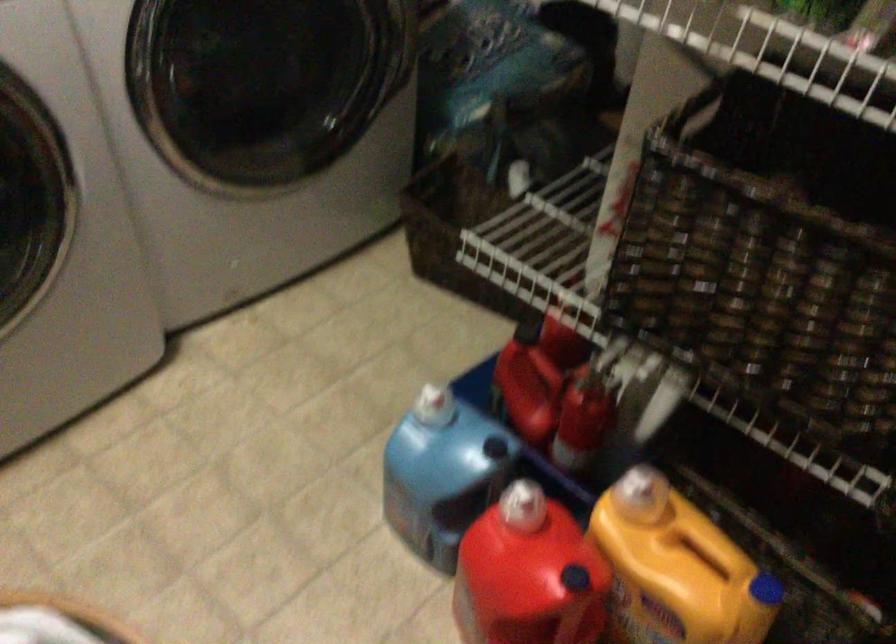
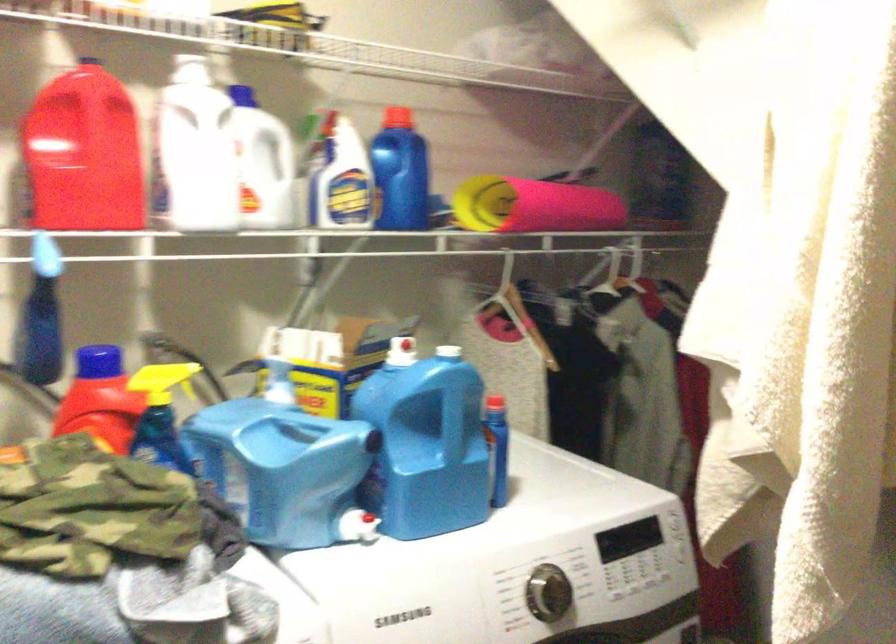
Question: Based on the continuous images, in which direction is the camera rotating? Reply with the corresponding letter.

Choices:
 (A) Left
 (B) Right
 (C) Up
 (D) Down

Answer: (C)